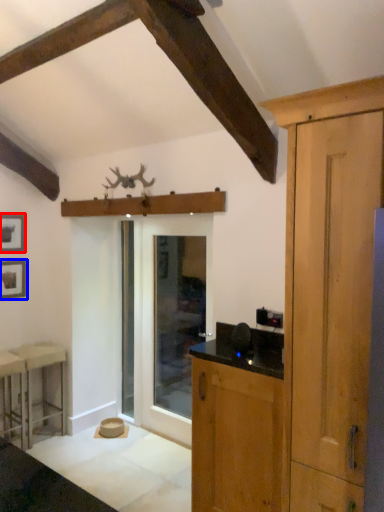
Question: Which of the following is the farthest to the observer, picture frame (highlighted by a red box) or picture frame (highlighted by a blue box)?

Choices:
 (A) picture frame
 (B) picture frame

Answer: (B)